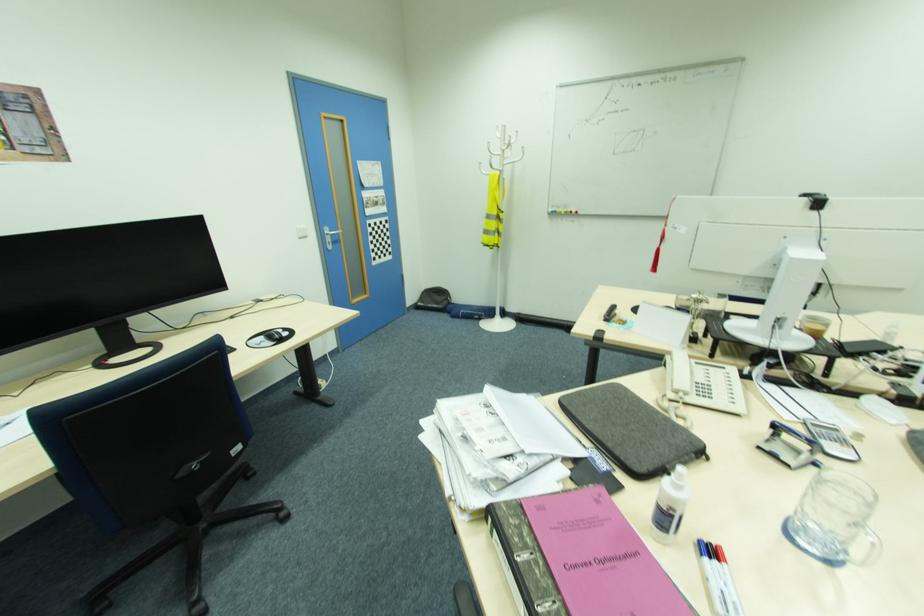
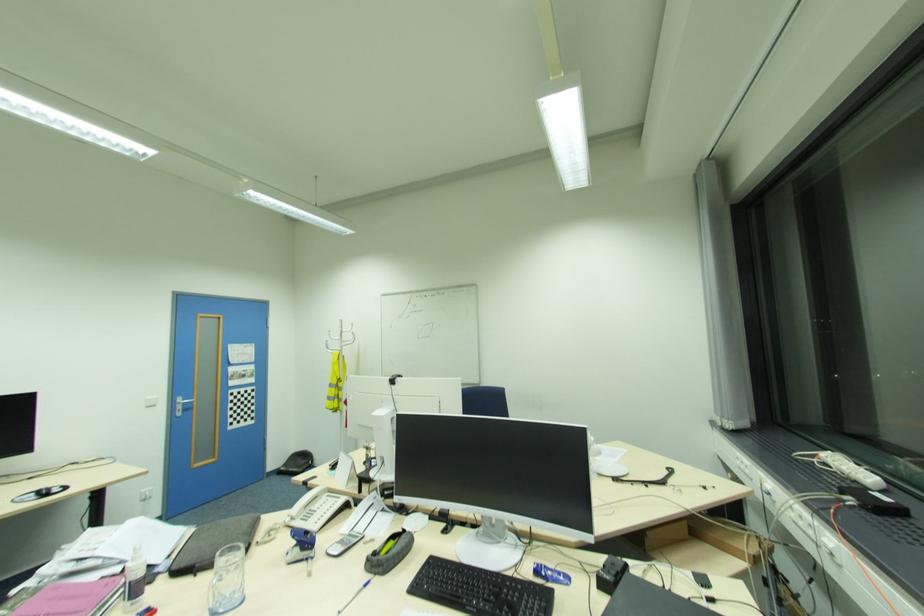
Locate, in the second image, the point that corresponds to point 329,232 in the first image.

(180, 400)